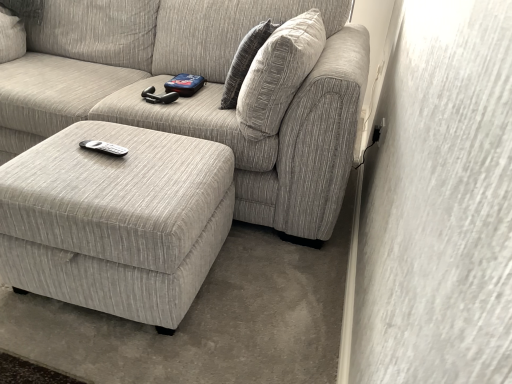
Find the location of a particular element. The image size is (512, 384). blank space situated above matte gray ottoman at lower left (from a real-world perspective) is located at coordinates (116, 156).